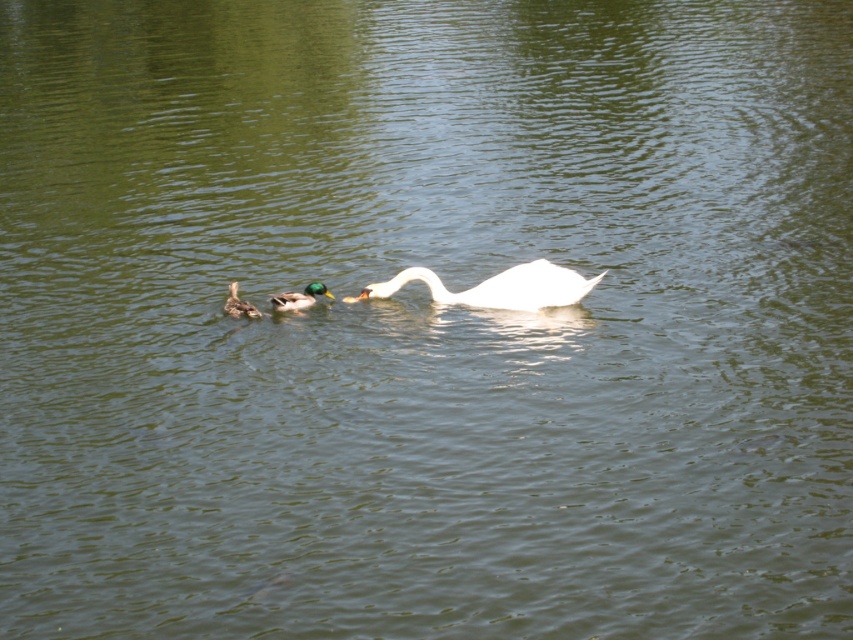
Question: Among these points, which one is nearest to the camera?

Choices:
 (A) (503, 272)
 (B) (245, 305)

Answer: (B)

Question: Does white glossy swan at center appear over green glossy duck at center?

Choices:
 (A) no
 (B) yes

Answer: (B)

Question: Is the position of white glossy swan at center more distant than that of brown matte duckling at lower left?

Choices:
 (A) yes
 (B) no

Answer: (B)

Question: Which is farther from the green glossy duck at center?

Choices:
 (A) brown matte duckling at lower left
 (B) white glossy swan at center

Answer: (B)

Question: Is green glossy duck at center bigger than brown matte duckling at lower left?

Choices:
 (A) no
 (B) yes

Answer: (B)

Question: Which point appears farthest from the camera in this image?

Choices:
 (A) (314, 285)
 (B) (244, 308)
 (C) (556, 276)

Answer: (A)